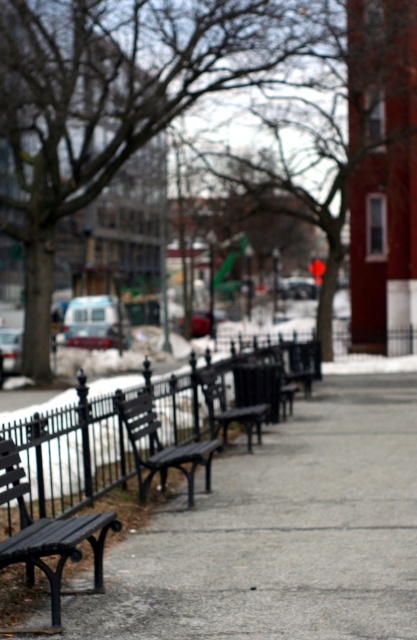
Question: Can you confirm if smooth concrete sidewalk at center is bigger than matte black bench at center?

Choices:
 (A) yes
 (B) no

Answer: (A)

Question: Among these points, which one is nearest to the camera?

Choices:
 (A) (215, 432)
 (B) (148, 406)
 (C) (10, 550)
 (D) (402, 468)

Answer: (C)

Question: Does smooth concrete sidewalk at center appear under matte black bench at lower left?

Choices:
 (A) no
 (B) yes

Answer: (B)

Question: Which is farther from the smooth concrete sidewalk at center?

Choices:
 (A) matte black bench at lower left
 (B) black wood bench at center
 (C) matte black bench at center

Answer: (A)

Question: Which of the following is the closest to the observer?

Choices:
 (A) matte black bench at lower left
 (B) black wood bench at center
 (C) matte black bench at center

Answer: (A)

Question: Is black wood bench at center positioned in front of matte black bench at center?

Choices:
 (A) no
 (B) yes

Answer: (B)